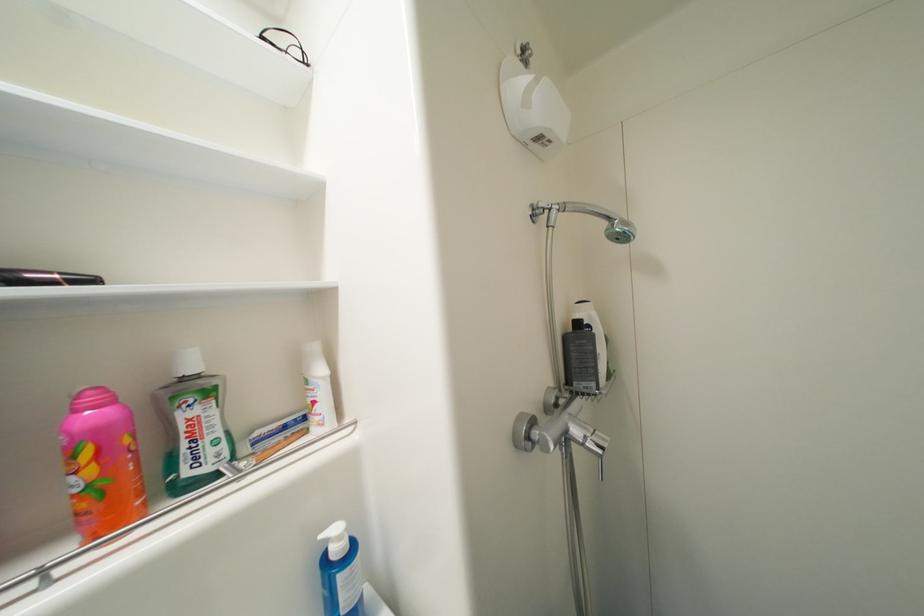
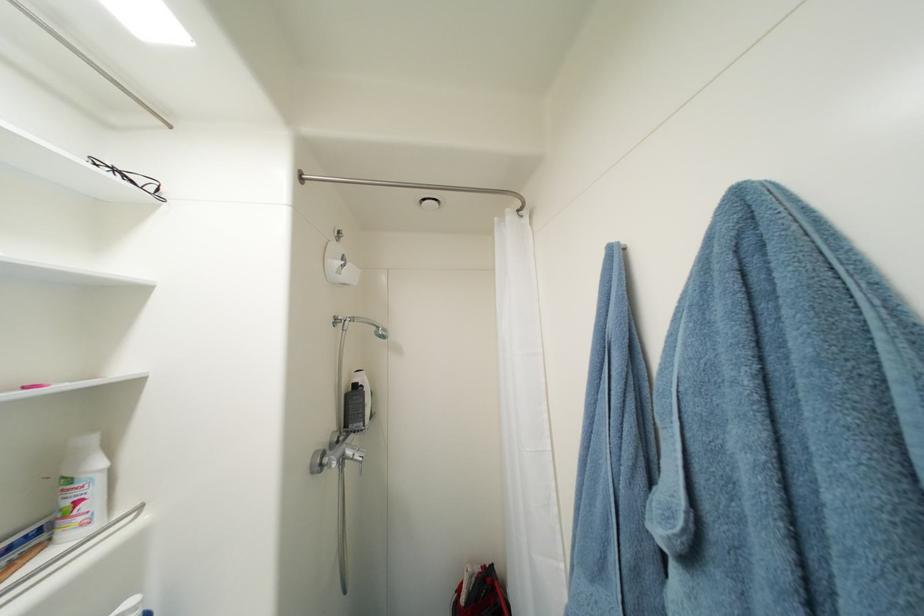
Where in the second image is the point corresponding to point (321, 405) from the first image?

(84, 504)